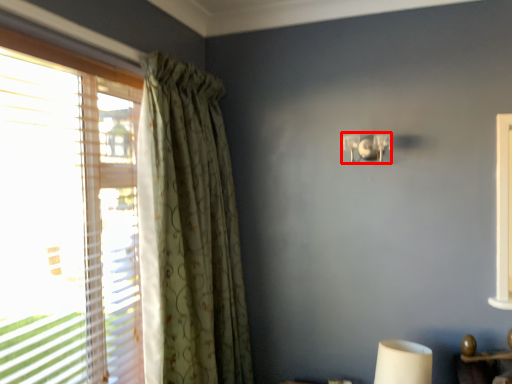
Question: Where is lamp (annotated by the red box) located in relation to curtain in the image?

Choices:
 (A) right
 (B) left

Answer: (A)